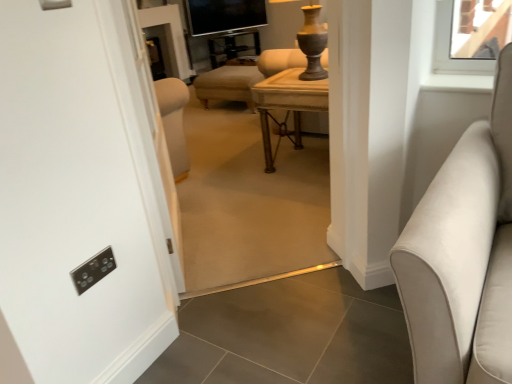
Question: Can you confirm if metallic gold side table at center is smaller than wooden table at center?

Choices:
 (A) yes
 (B) no

Answer: (B)

Question: Considering the relative sizes of metallic gold side table at center and wooden table at center in the image provided, is metallic gold side table at center wider than wooden table at center?

Choices:
 (A) yes
 (B) no

Answer: (A)

Question: Is wooden table at center at the back of metallic gold side table at center?

Choices:
 (A) no
 (B) yes

Answer: (A)

Question: From the image's perspective, is metallic gold side table at center under wooden table at center?

Choices:
 (A) no
 (B) yes

Answer: (A)

Question: From the image's perspective, is metallic gold side table at center on top of wooden table at center?

Choices:
 (A) yes
 (B) no

Answer: (A)

Question: From a real-world perspective, does metallic gold side table at center sit lower than wooden table at center?

Choices:
 (A) yes
 (B) no

Answer: (A)

Question: Does suede-like beige sofa at right appear on the left side of black glass tv at upper center?

Choices:
 (A) no
 (B) yes

Answer: (A)

Question: From the image's perspective, is suede-like beige sofa at right under black glass tv at upper center?

Choices:
 (A) yes
 (B) no

Answer: (A)

Question: From a real-world perspective, is suede-like beige sofa at right on top of black glass tv at upper center?

Choices:
 (A) yes
 (B) no

Answer: (B)

Question: Considering the relative positions of suede-like beige sofa at right and black glass tv at upper center in the image provided, is suede-like beige sofa at right to the right of black glass tv at upper center from the viewer's perspective?

Choices:
 (A) yes
 (B) no

Answer: (A)

Question: Is suede-like beige sofa at right wider than black glass tv at upper center?

Choices:
 (A) yes
 (B) no

Answer: (A)

Question: Is suede-like beige sofa at right oriented away from black glass tv at upper center?

Choices:
 (A) yes
 (B) no

Answer: (B)

Question: Is suede-like beige sofa at right smaller than wooden table at center?

Choices:
 (A) no
 (B) yes

Answer: (A)